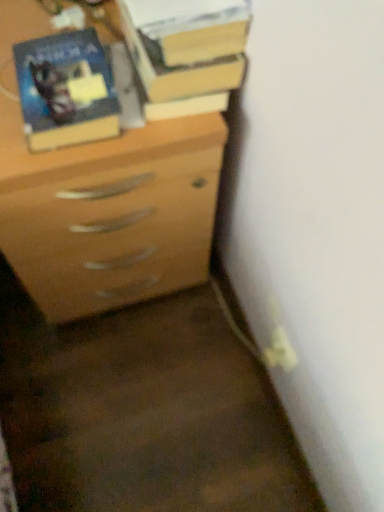
Locate an element on the screen. vacant area that is situated to the right of matte black book at upper left is located at coordinates (151, 118).